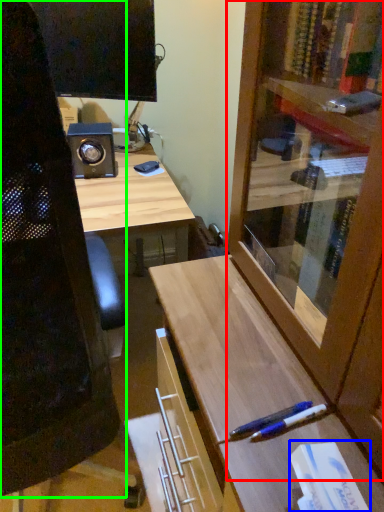
Question: Which object is the closest to the cabinetry (highlighted by a red box)? Choose among these: book (highlighted by a blue box) or computer chair (highlighted by a green box).

Choices:
 (A) book
 (B) computer chair

Answer: (A)